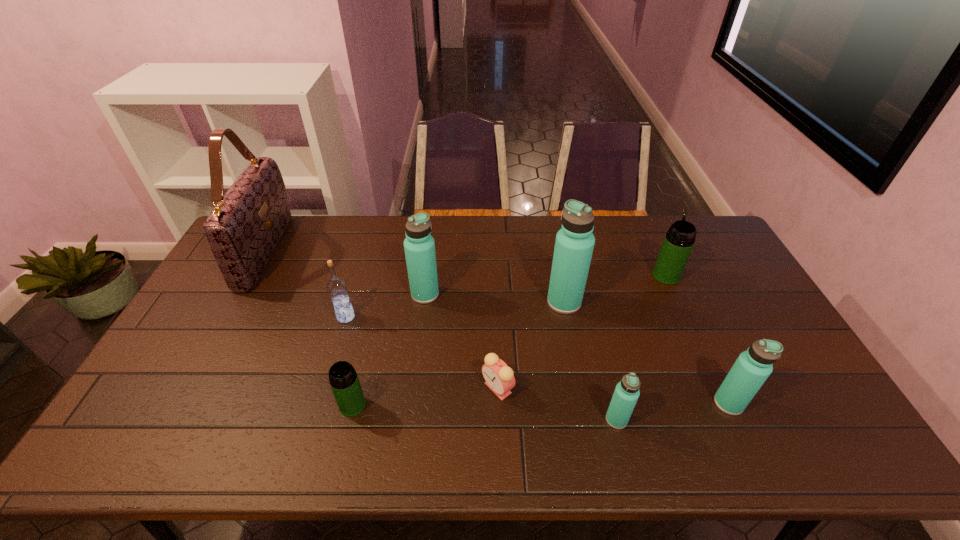
Image resolution: width=960 pixels, height=540 pixels. What are the coordinates of `the third closest thermos bottle to the tallest object` in the screenshot? It's located at (574, 244).

Locate which thermos bottle ranks fifth in proximity to the eighth shortest object. Please provide its 2D coordinates. Your answer should be formatted as a tuple, i.e. [(x, y)], where the tuple contains the x and y coordinates of a point satisfying the conditions above.

[(343, 379)]

What are the coordinates of `aqua thermos bottle that stands as the closest to the biggest aqua thermos bottle` in the screenshot? It's located at (626, 394).

Where is `aqua thermos bottle that is the third closest to the bigger green thermos bottle`? Image resolution: width=960 pixels, height=540 pixels. aqua thermos bottle that is the third closest to the bigger green thermos bottle is located at coordinates (626, 394).

Find the location of `vacant space that satisfies the following two spatial constraints: 1. on the face of the third biggest aqua thermos bottle; 2. on the left side of the fifth object from left to right`. vacant space that satisfies the following two spatial constraints: 1. on the face of the third biggest aqua thermos bottle; 2. on the left side of the fifth object from left to right is located at coordinates (498, 403).

Find the location of a particular element. The width and height of the screenshot is (960, 540). blank space that satisfies the following two spatial constraints: 1. on the back side of the smallest aqua thermos bottle; 2. on the face of the fifth object from left to right is located at coordinates (609, 388).

Where is `blank space that satisfies the following two spatial constraints: 1. from the spout of the right green thermos bottle; 2. on the front of the handbag with the clasp`? The image size is (960, 540). blank space that satisfies the following two spatial constraints: 1. from the spout of the right green thermos bottle; 2. on the front of the handbag with the clasp is located at coordinates (655, 251).

Find the location of a particular element. vacant area in the image that satisfies the following two spatial constraints: 1. on the front of the leftmost aqua thermos bottle with the clasp; 2. on the right side of the tallest object is located at coordinates (242, 294).